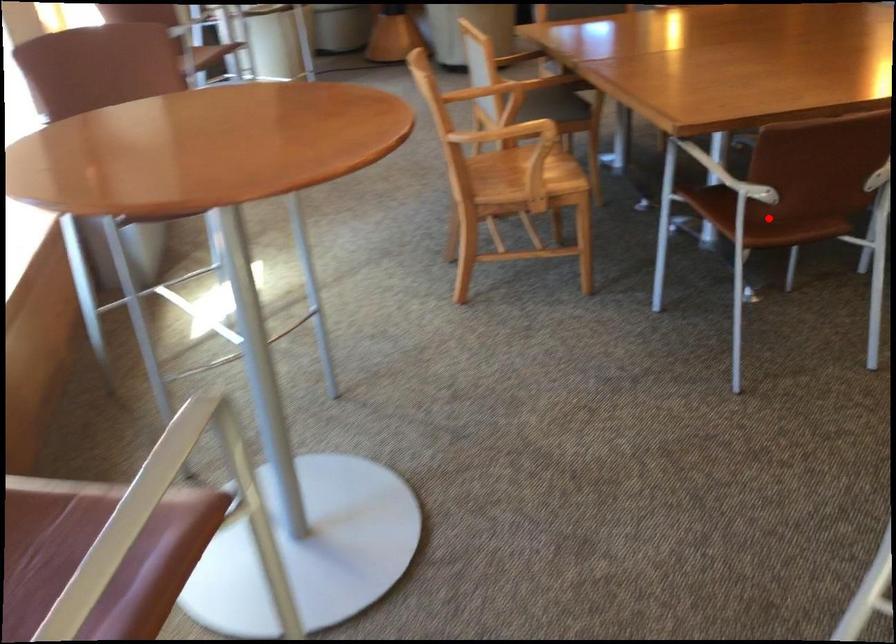
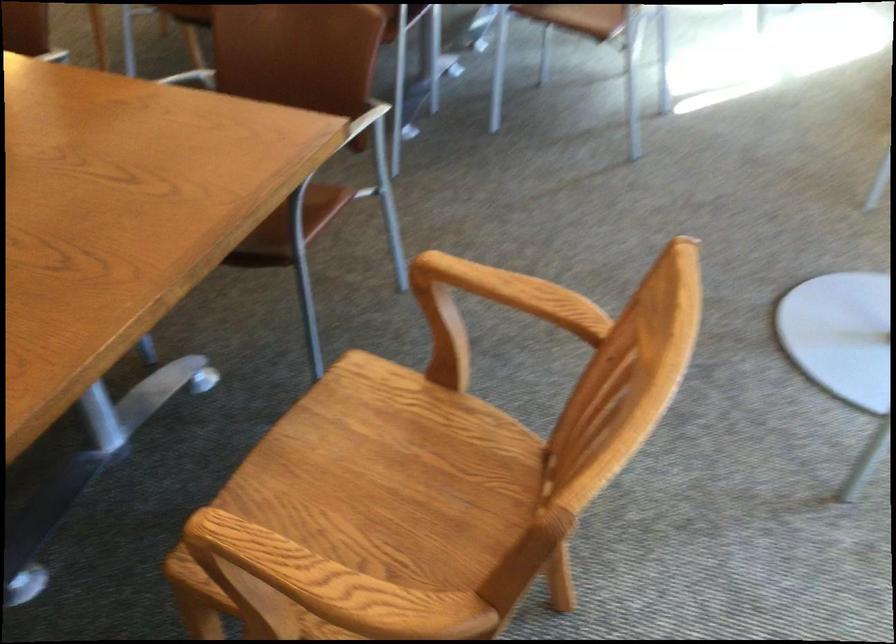
Question: I am providing you with two images of the same scene from different viewpoints. A red point is marked on the first image. Is the red point's position out of view in image 2?

Choices:
 (A) Yes
 (B) No

Answer: (A)